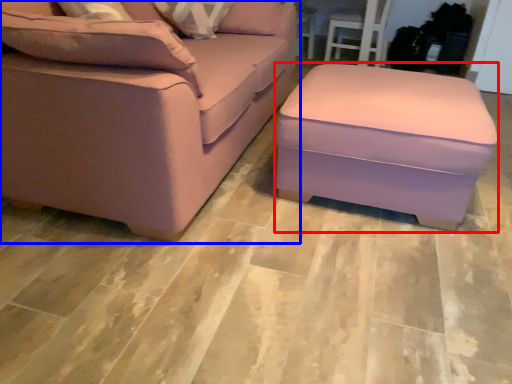
Question: Among these objects, which one is nearest to the camera, stool (highlighted by a red box) or studio couch (highlighted by a blue box)?

Choices:
 (A) stool
 (B) studio couch

Answer: (B)